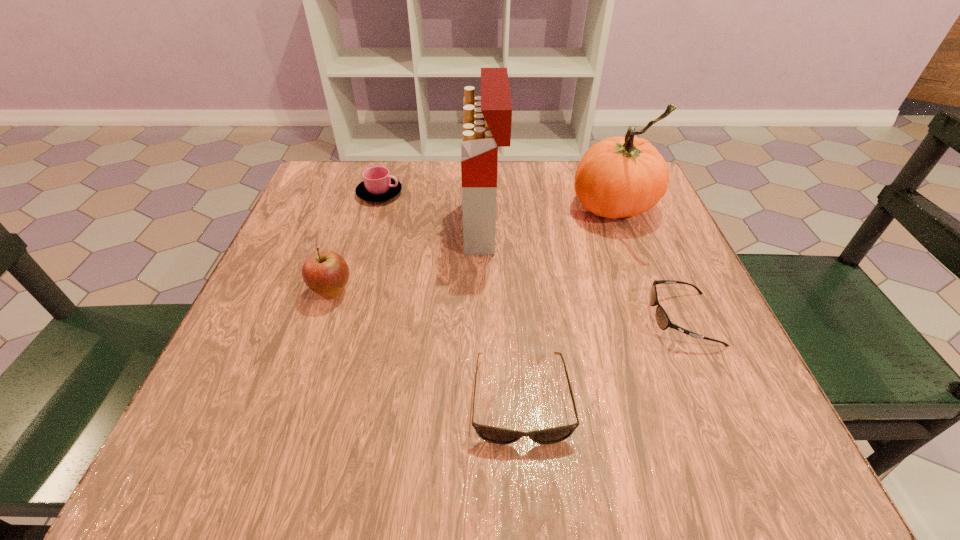
The width and height of the screenshot is (960, 540). Find the location of `apple that is at the left edge`. apple that is at the left edge is located at coordinates (326, 273).

The image size is (960, 540). In order to click on cup present at the left edge in this screenshot , I will do `click(378, 185)`.

I want to click on pumpkin that is at the right edge, so click(x=618, y=177).

Locate an element on the screen. The image size is (960, 540). sunglasses located at the right edge is located at coordinates (662, 319).

Where is `object that is at the far left corner`? Image resolution: width=960 pixels, height=540 pixels. object that is at the far left corner is located at coordinates (378, 185).

In order to click on object located at the far right corner in this screenshot , I will do `click(618, 177)`.

Where is `vacant space at the far edge`? This screenshot has width=960, height=540. vacant space at the far edge is located at coordinates [417, 176].

The image size is (960, 540). Identify the location of vacant space at the near edge of the desktop. tap(617, 448).

The height and width of the screenshot is (540, 960). Identify the location of vacant space at the left edge. (239, 340).

This screenshot has width=960, height=540. In the image, there is a desktop. Identify the location of free space at the right edge. (647, 282).